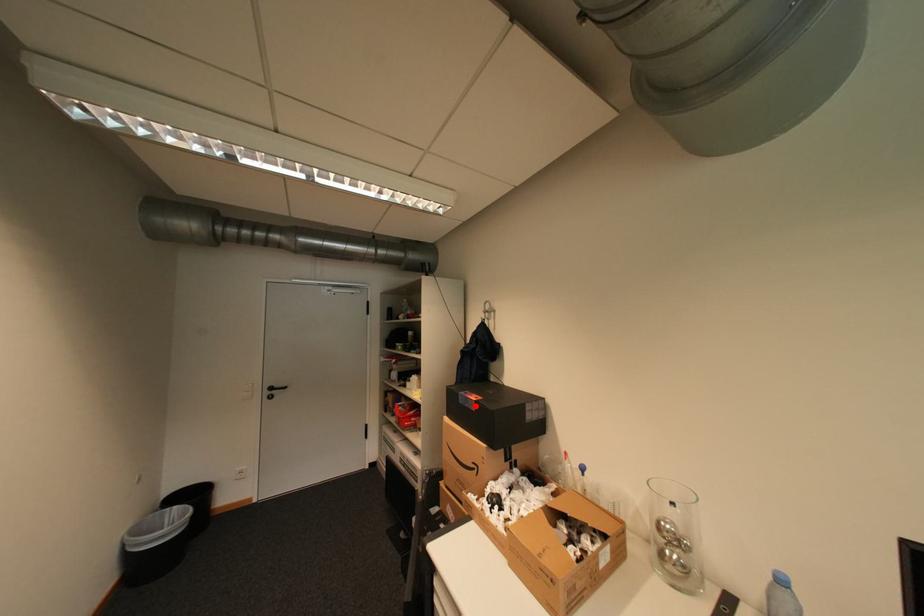
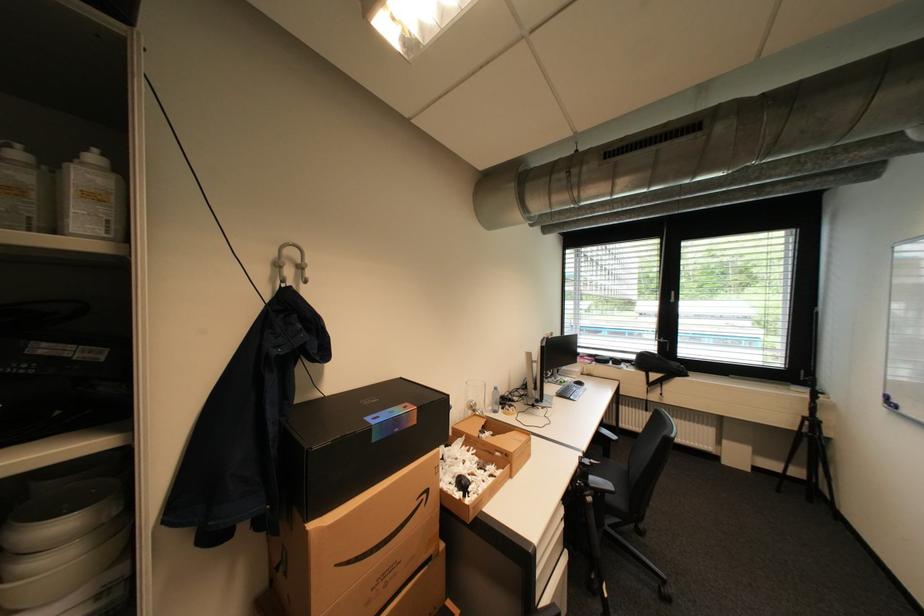
In the second image, find the point that corresponds to the highlighted location in the first image.

(405, 431)